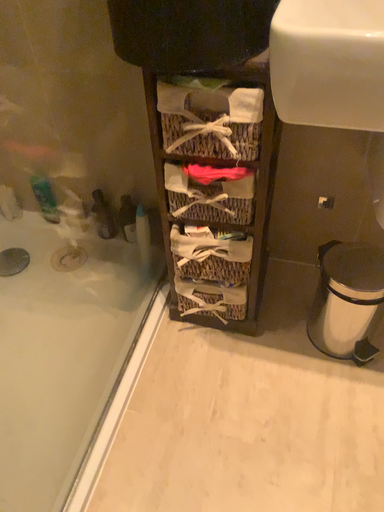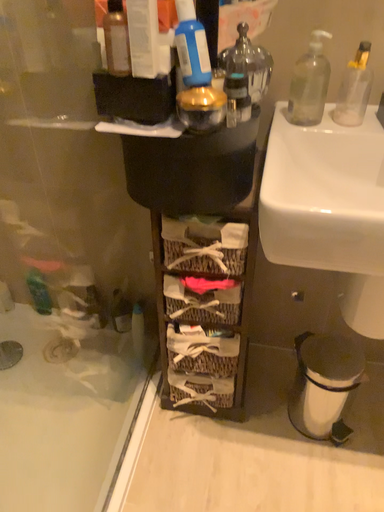
Question: Which way did the camera rotate in the video?

Choices:
 (A) rotated downward
 (B) rotated upward

Answer: (B)